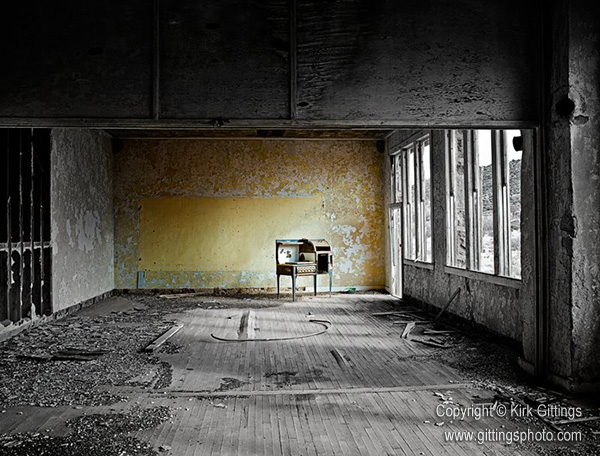
The width and height of the screenshot is (600, 456). I want to click on ceiling, so click(x=253, y=133).